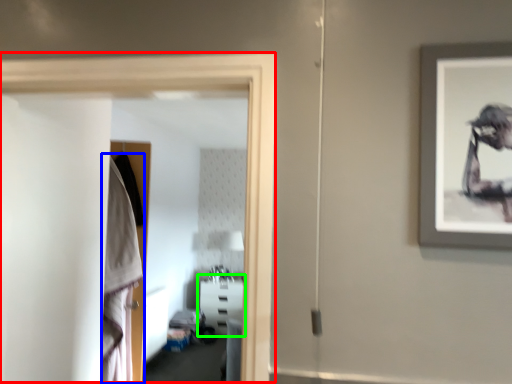
Question: Which object is the farthest from glass door (highlighted by a red box)? Choose among these: robe (highlighted by a blue box) or furniture (highlighted by a green box).

Choices:
 (A) robe
 (B) furniture

Answer: (B)